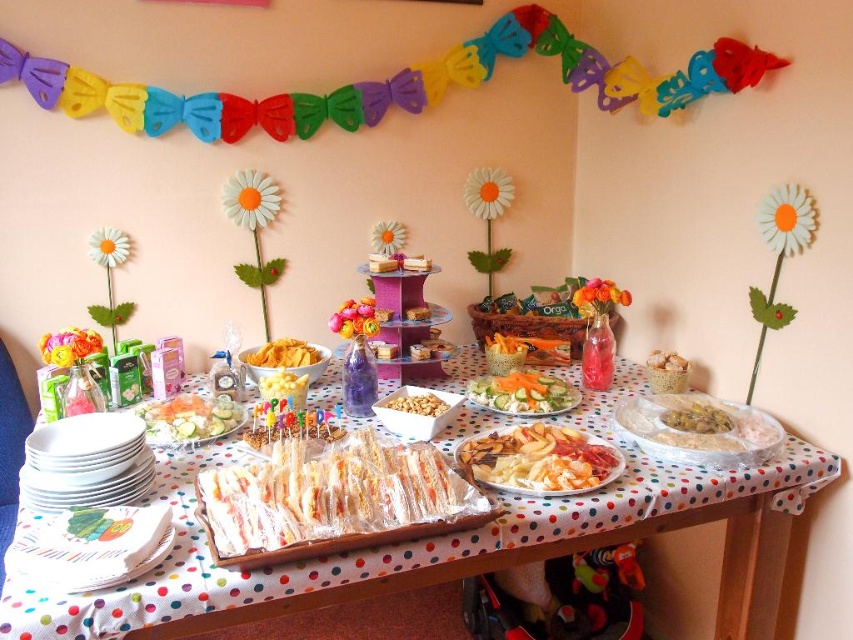
Question: Does white matte popcorn at center appear over golden crumbly pastry at center?

Choices:
 (A) no
 (B) yes

Answer: (A)

Question: Is sliced cucumber at center further to camera compared to yellow crispy chips at center?

Choices:
 (A) no
 (B) yes

Answer: (A)

Question: Which point is farther to the camera?

Choices:
 (A) (432, 561)
 (B) (410, 400)
 (C) (708, 422)

Answer: (B)

Question: Which object appears farthest from the camera in this image?

Choices:
 (A) white matte popcorn at center
 (B) shiny silver platter at center
 (C) yellow creamy rice at center

Answer: (A)

Question: From the image, what is the correct spatial relationship of white polka dot tablecloth at center in relation to shiny silver platter at center?

Choices:
 (A) left
 (B) right

Answer: (A)

Question: Which of the following is the farthest from the observer?

Choices:
 (A) (674, 410)
 (B) (270, 349)
 (C) (498, 376)
 (D) (9, 552)

Answer: (C)